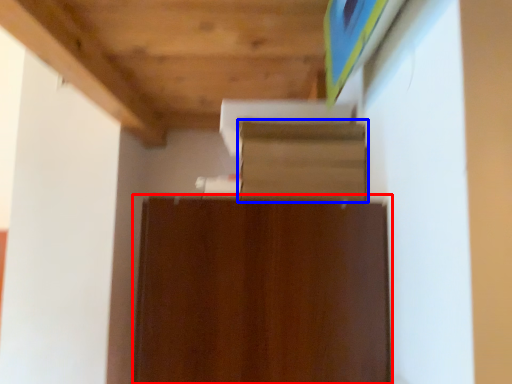
Question: Which object appears farthest to the camera in this image, cabinetry (highlighted by a red box) or shelf (highlighted by a blue box)?

Choices:
 (A) cabinetry
 (B) shelf

Answer: (B)